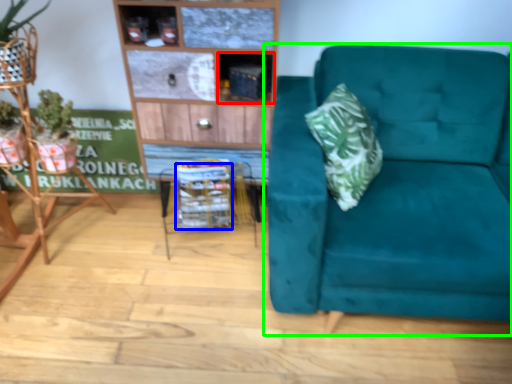
Question: Which object is the farthest from cabinet (highlighted by a red box)? Choose among these: basket (highlighted by a blue box) or studio couch (highlighted by a green box).

Choices:
 (A) basket
 (B) studio couch

Answer: (B)